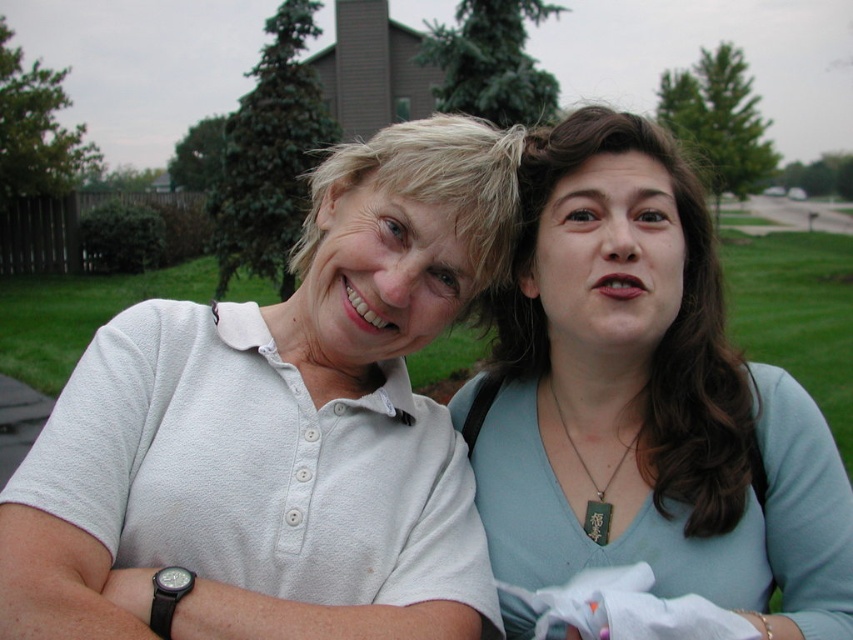
You are a photographer standing in front of the two people in the image. You need to adjust your camera to focus on the white matte shirt at left and the matte white shirt at upper left. Which shirt should you focus on first to ensure proper focus given their heights?

The white matte shirt at left is not as tall as the matte white shirt at upper left, so you should focus on the matte white shirt at upper left first since it is taller and likely closer to the camera.

You are a photographer standing 1.5 meters away from the two people in the scene. You want to take a photo that includes both the white matte shirt at left and the matte white shirt at upper left without any part of them being cut off. What is the minimum width of your camera lens in centimeters to capture both shirts in the frame?

The white matte shirt at left and the matte white shirt at upper left are 40.92 centimeters apart. To capture both shirts in the frame without any part being cut off, the camera lens must be at least 40.92 centimeters wide.

You are a photographer trying to capture a clear shot of the white matte shirt at left and the matte white shirt at upper left. Which one is lower in the frame?

The white matte shirt at left is positioned under the matte white shirt at upper left, so it is lower in the frame.